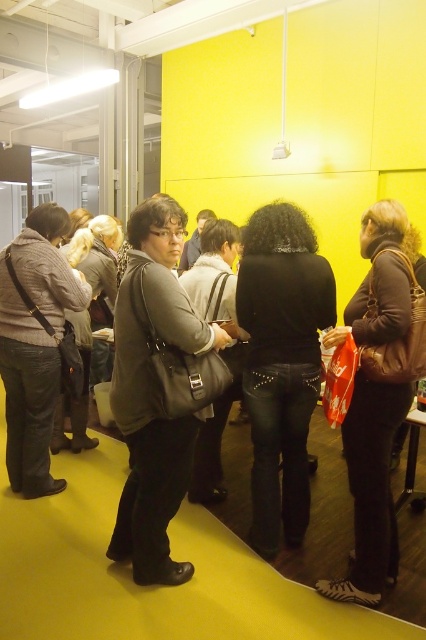
Is matte black bag at center to the right of black studded jeans at center from the viewer's perspective?

No, matte black bag at center is not to the right of black studded jeans at center.

Where is `matte black bag at center`? The height and width of the screenshot is (640, 426). matte black bag at center is located at coordinates pyautogui.click(x=158, y=388).

Who is shorter, knit sweater at left or matte black jacket at center?

With less height is matte black jacket at center.

Can you confirm if knit sweater at left is bigger than matte black jacket at center?

No, knit sweater at left is not bigger than matte black jacket at center.

Does point (8, 291) lie behind point (236, 230)?

That is False.

Find the location of `knit sweater at left`. knit sweater at left is located at coordinates (34, 346).

Who is shorter, black studded jeans at center or brown leather jacket at center?

black studded jeans at center

Does point (275, 209) come farther from viewer compared to point (357, 321)?

Yes, it is behind point (357, 321).

Identify the location of black studded jeans at center. This screenshot has height=640, width=426. (282, 364).